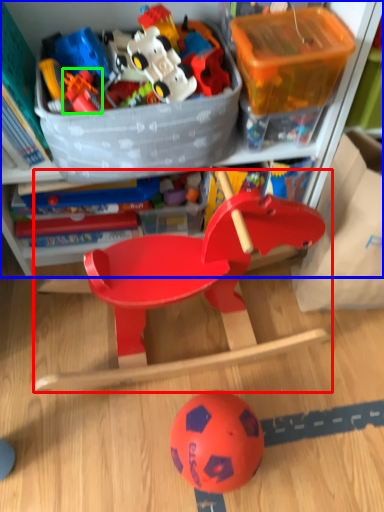
Question: Which object is the closest to the toy (highlighted by a red box)? Choose among these: cabinetry (highlighted by a blue box) or toy (highlighted by a green box).

Choices:
 (A) cabinetry
 (B) toy

Answer: (A)